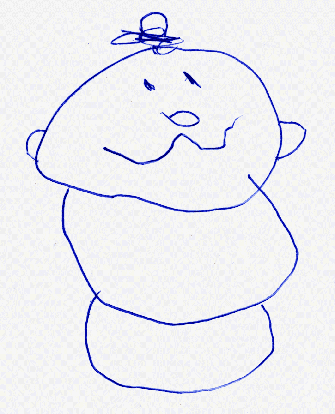
I want to click on chest, so click(178, 291).